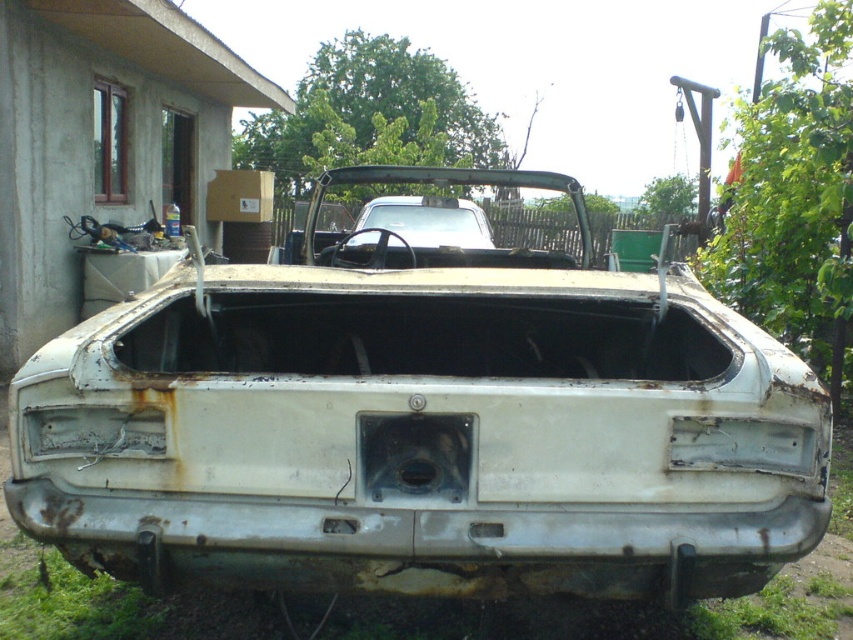
Question: Can you confirm if rusty metal car at center is positioned above white matte car at center?

Choices:
 (A) no
 (B) yes

Answer: (A)

Question: Does rusty metal car at center appear on the left side of white matte car at center?

Choices:
 (A) no
 (B) yes

Answer: (A)

Question: Does rusty metal car at center have a lesser width compared to white matte car at center?

Choices:
 (A) no
 (B) yes

Answer: (A)

Question: Which point appears farthest from the camera in this image?

Choices:
 (A) (660, 269)
 (B) (402, 236)

Answer: (B)